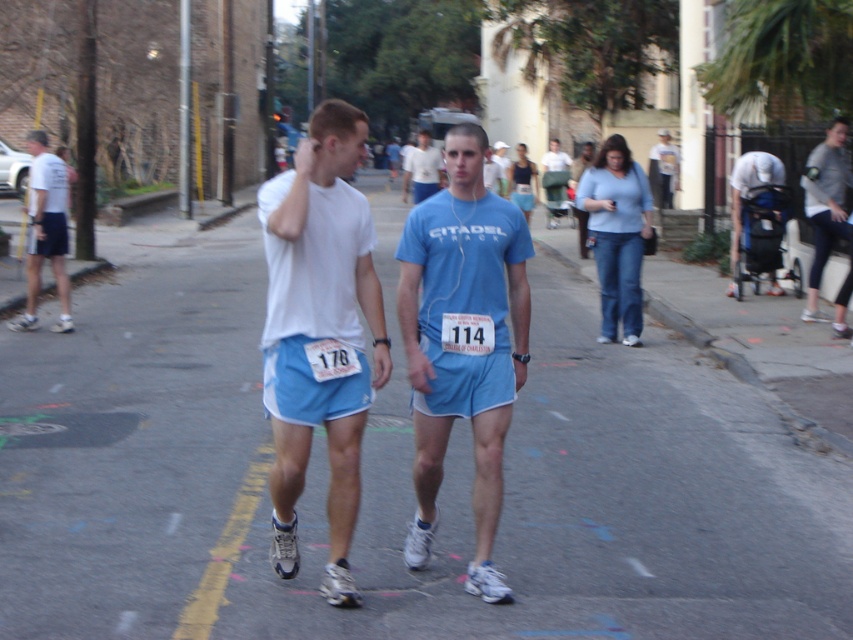
From the picture: A photographer is positioned at the camera location and wants to capture both the blue fabric stroller at right and the runner with bib number 114 in the same frame. Given the camera has a 50mm lens with a field of view of 46 degrees, can the photographer fit both subjects into the frame?

The blue fabric stroller at right and camera are 12.91 meters apart. Since the distance between them is within the camera lens field of view of 46 degrees, the photographer can capture both subjects in the same frame.